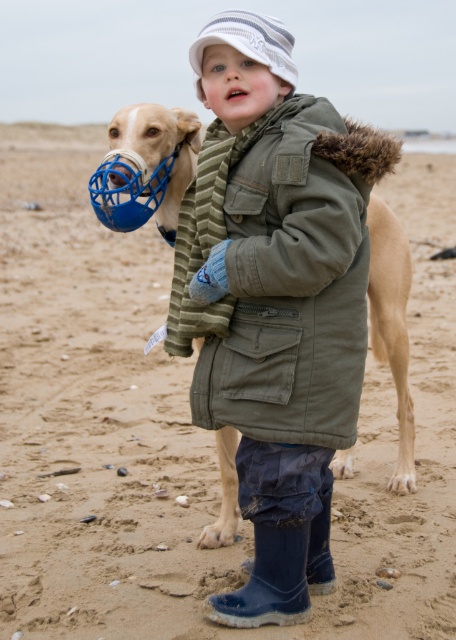
Is point (237, 76) farther from viewer compared to point (218, 68)?

No, it is in front of (218, 68).

Where is `pink matte lips at center`? This screenshot has height=640, width=456. pink matte lips at center is located at coordinates (236, 90).

Can you confirm if olive-green fabric coat at center is smaller than blue rubber nose at center?

Actually, olive-green fabric coat at center might be larger than blue rubber nose at center.

Measure the distance between olive-green fabric coat at center and camera.

2.03 meters

The height and width of the screenshot is (640, 456). I want to click on olive-green fabric coat at center, so click(283, 307).

Is olive-green fabric coat at center further to the viewer compared to white striped knit cap at upper center?

No, olive-green fabric coat at center is in front of white striped knit cap at upper center.

Can you confirm if olive-green fabric coat at center is bigger than white striped knit cap at upper center?

Yes.

Find the location of a particular element. The height and width of the screenshot is (640, 456). olive-green fabric coat at center is located at coordinates (283, 307).

Locate an element on the screen. olive-green fabric coat at center is located at coordinates (283, 307).